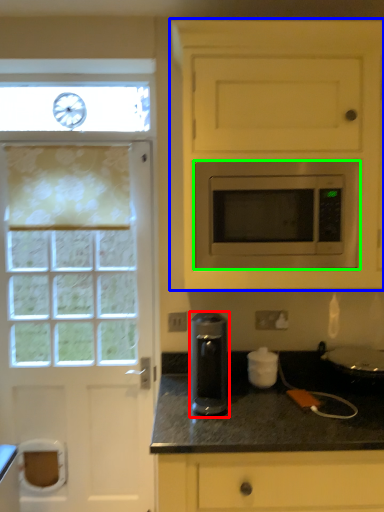
Question: Which is farther away from kitchen appliance (highlighted by a red box)? cabinetry (highlighted by a blue box) or microwave oven (highlighted by a green box)?

Choices:
 (A) cabinetry
 (B) microwave oven

Answer: (A)